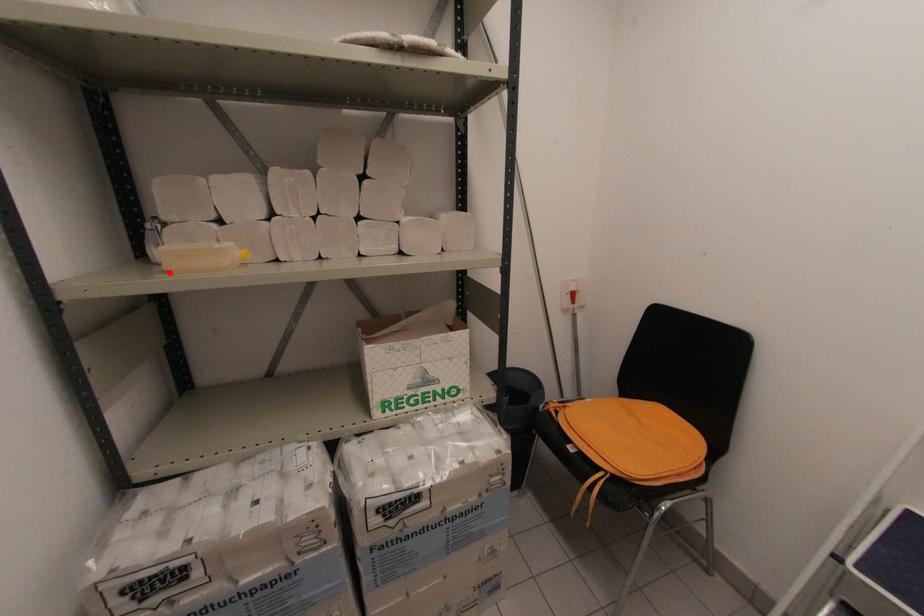
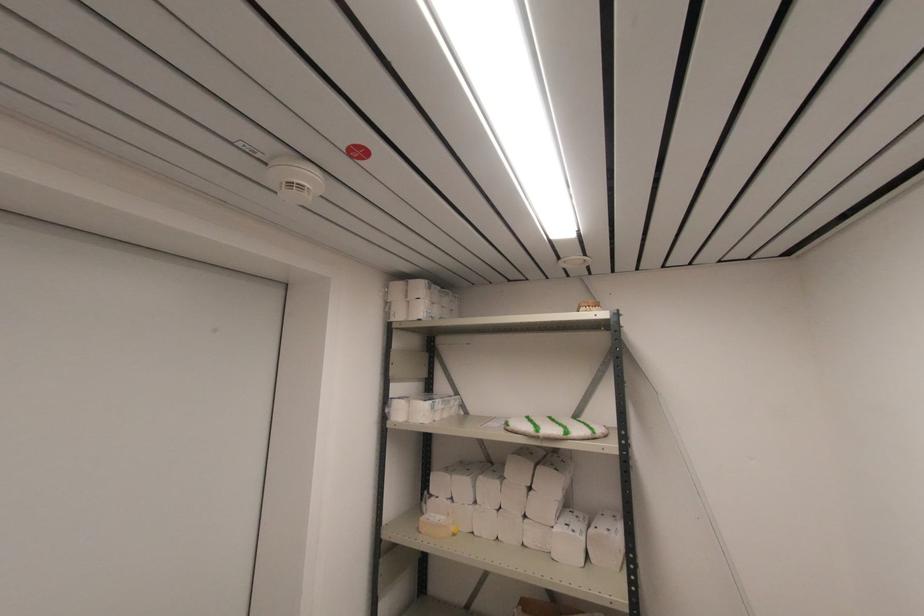
Locate, in the second image, the point that corresponds to the highlighted location in the first image.

(420, 533)